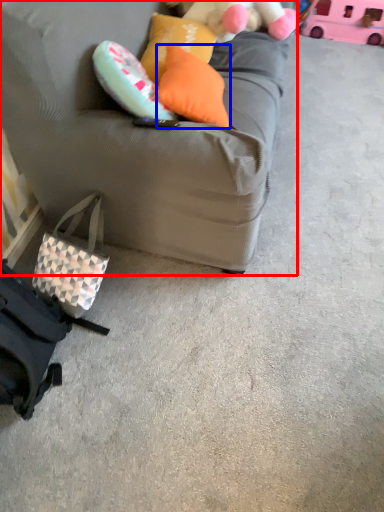
Question: Which object is further to the camera taking this photo, studio couch (highlighted by a red box) or pillow (highlighted by a blue box)?

Choices:
 (A) studio couch
 (B) pillow

Answer: (B)